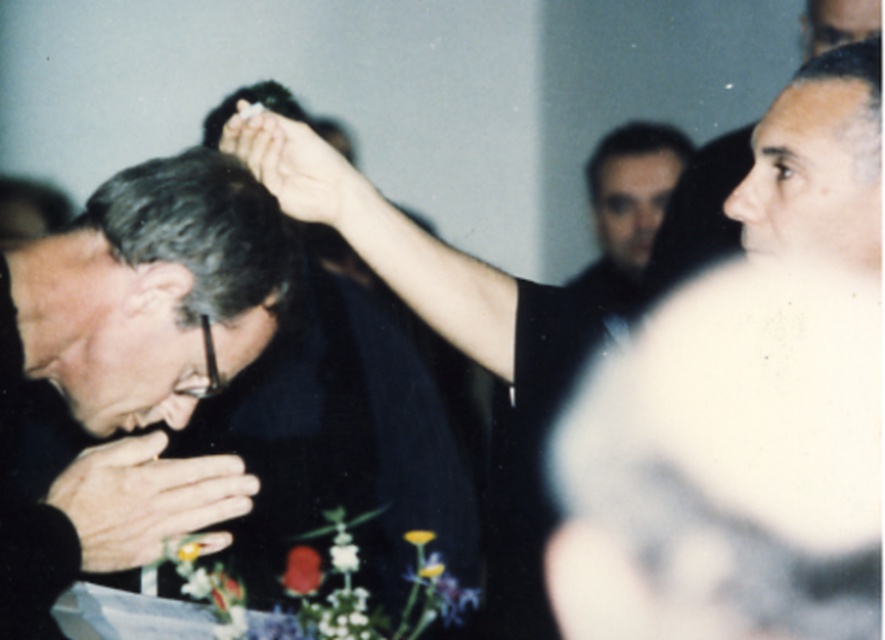
You are a photographer at the event and need to ensure the white matte flower at center is visible in the photo. Given that the smooth skin hand at center is currently blocking part of it, can you adjust the composition to make the flower fully visible without moving the hand?

The smooth skin hand at center is bigger than the white matte flower at center. Since the hand is blocking part of the flower, adjusting the composition by moving the camera angle slightly upward or to the side could allow the flower to be fully visible while keeping the hand in the frame.

You are a photographer at a formal event. You notice the gray matte hair at center and the white matte flower at center in your camera viewfinder. The distance between them is crucial for a perfect shot. Can you determine if they are within the ideal framing distance of 20 inches for a closeup portrait?

The gray matte hair at center and white matte flower at center are 21.45 inches apart from each other. Since the ideal framing distance is 20 inches, they are slightly beyond the recommended distance for a closeup portrait.

You are standing at the point labeled point (243, 195). Can you see the point labeled point (295, 554) behind you?

Yes, because point (243, 195) is in front of point (295, 554), so you can see point (295, 554) behind you.